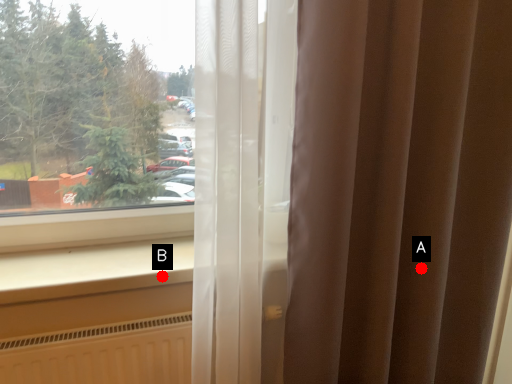
Question: Two points are circled on the image, labeled by A and B beside each circle. Which of the following is the closest to the observer?

Choices:
 (A) A is closer
 (B) B is closer

Answer: (B)